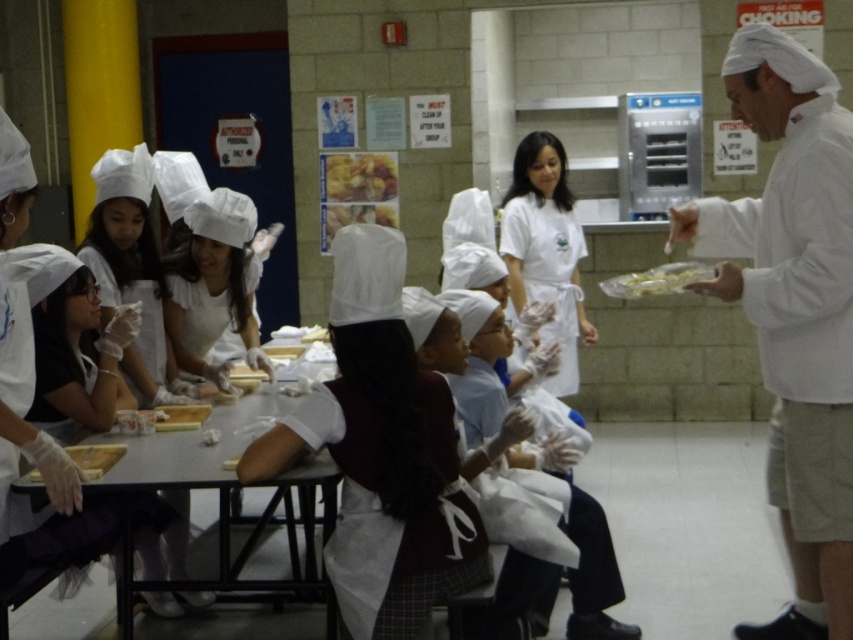
You are a student in the cooking class and need to place the golden brown crumbly pastry at center onto the smooth white table at center. Considering their sizes, will the pastry fit comfortably on the table?

The smooth white table at center is larger in size than the golden brown crumbly pastry at center, so the pastry will fit comfortably on the table.